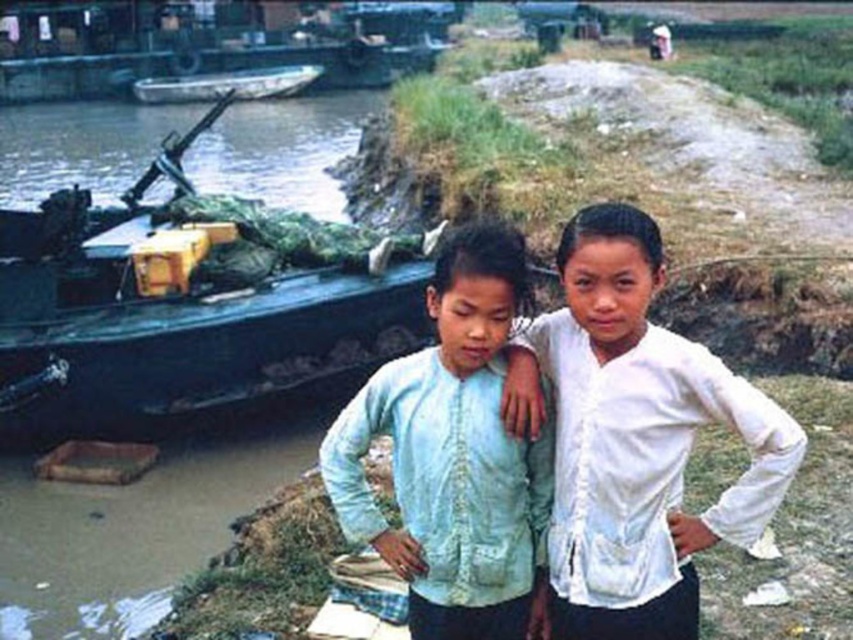
You are a photographer trying to capture a wide shot of the scene. The green camouflage boat at left and the white matte shirt at center are both in your frame. Based on their sizes in the image, which object would appear smaller?

The green camouflage boat at left appears smaller than the white matte shirt at center because it has a lesser width.

You are planning to transport a large piece of equipment that requires a wider boat. Based on the scene, which boat between the green camouflage boat at left and the metallic gray boat at upper left would be more suitable?

The metallic gray boat at upper left is wider than the green camouflage boat at left, making it more suitable for transporting the large piece of equipment that requires a wider boat.